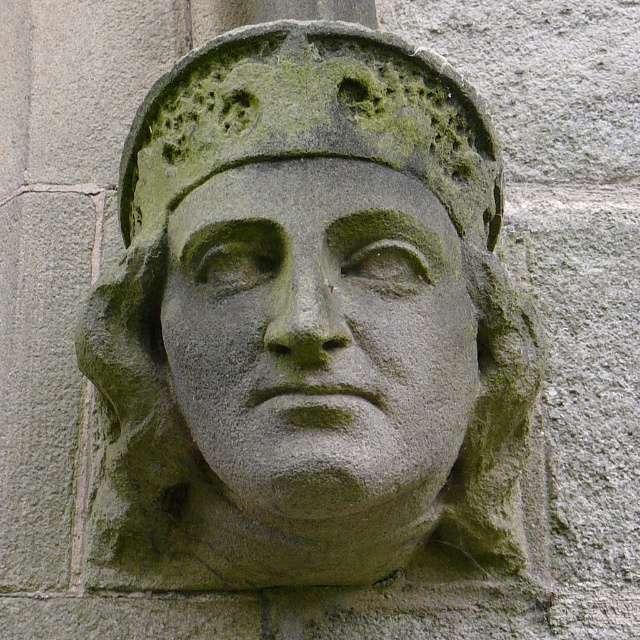
Question: Which point is closer to the camera?

Choices:
 (A) green stone face at center
 (B) green stone head at center

Answer: (B)

Question: Is green stone head at center positioned at the back of green stone face at center?

Choices:
 (A) yes
 (B) no

Answer: (B)

Question: Is green stone head at center positioned behind green stone face at center?

Choices:
 (A) no
 (B) yes

Answer: (A)

Question: Does green stone head at center come behind green stone face at center?

Choices:
 (A) yes
 (B) no

Answer: (B)